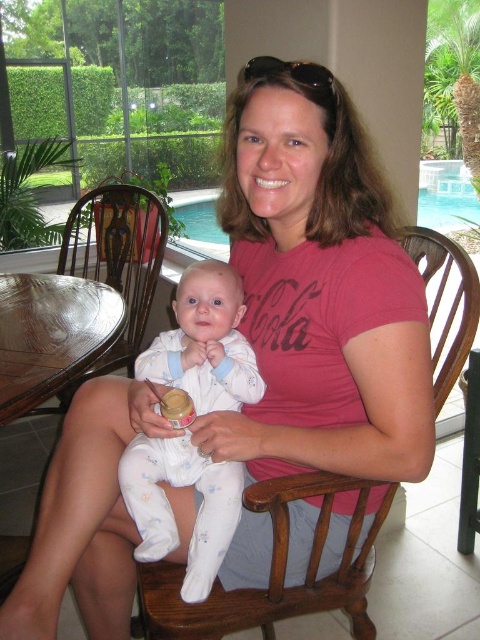
Is white cotton onesie at center shorter than wooden rocking chair at center?

Indeed, white cotton onesie at center has a lesser height compared to wooden rocking chair at center.

Is white cotton onesie at center in front of wooden rocking chair at center?

No.

You are a GUI agent. You are given a task and a screenshot of the screen. Output one action in this format:
    pyautogui.click(x=<x>, y=<y>)
    Task: Click on the white cotton onesie at center
    The width and height of the screenshot is (480, 640).
    Given the screenshot: What is the action you would take?
    coord(170,508)